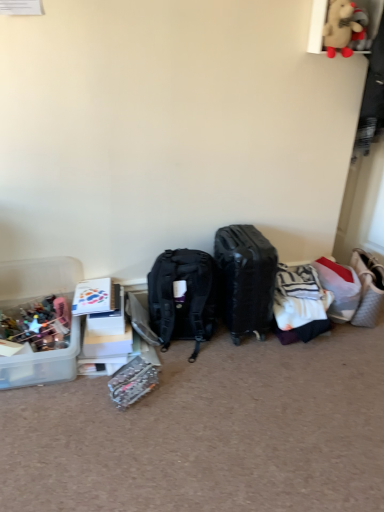
Question: From the image's perspective, is white striped fabric at center-right beneath clear plastic kit at lower center?

Choices:
 (A) yes
 (B) no

Answer: (B)

Question: Is white striped fabric at center-right looking in the opposite direction of clear plastic kit at lower center?

Choices:
 (A) yes
 (B) no

Answer: (B)

Question: Is clear plastic kit at lower center inside white striped fabric at center-right?

Choices:
 (A) no
 (B) yes

Answer: (A)

Question: Considering the relative sizes of white striped fabric at center-right and clear plastic kit at lower center in the image provided, is white striped fabric at center-right taller than clear plastic kit at lower center?

Choices:
 (A) no
 (B) yes

Answer: (B)

Question: Is white striped fabric at center-right completely or partially outside of clear plastic kit at lower center?

Choices:
 (A) yes
 (B) no

Answer: (A)

Question: Does white striped fabric at center-right have a lesser width compared to clear plastic kit at lower center?

Choices:
 (A) yes
 (B) no

Answer: (B)

Question: Is black matte suitcase at center looking in the opposite direction of fluffy beige teddy bear at upper right?

Choices:
 (A) yes
 (B) no

Answer: (B)

Question: From the image's perspective, does black matte suitcase at center appear lower than fluffy beige teddy bear at upper right?

Choices:
 (A) yes
 (B) no

Answer: (A)

Question: From a real-world perspective, is black matte suitcase at center located beneath fluffy beige teddy bear at upper right?

Choices:
 (A) no
 (B) yes

Answer: (B)

Question: Is black matte suitcase at center placed right next to fluffy beige teddy bear at upper right?

Choices:
 (A) yes
 (B) no

Answer: (B)

Question: Is the depth of black matte suitcase at center greater than that of fluffy beige teddy bear at upper right?

Choices:
 (A) no
 (B) yes

Answer: (B)

Question: Is black matte suitcase at center to the right of fluffy beige teddy bear at upper right from the viewer's perspective?

Choices:
 (A) no
 (B) yes

Answer: (A)

Question: Is fluffy beige teddy bear at upper right not inside white quilted fabric handbag at right?

Choices:
 (A) yes
 (B) no

Answer: (A)